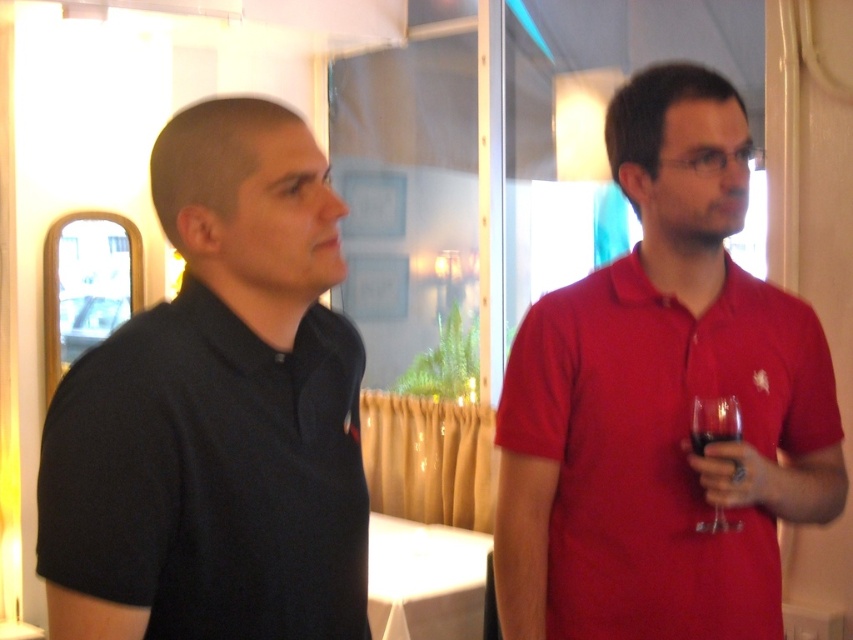
You are a photographer setting up for a group photo. You need to position two people exactly 3 feet apart. Currently, the black matte shirt at left and the matte red polo shirt at right are positioned at their current spots. Can they stay in their current positions for the photo?

The distance between the black matte shirt at left and the matte red polo shirt at right is 24.59 inches, which is less than 3 feet. Therefore, they need to move further apart to meet the 36 inches requirement for the group photo.

You are at a social gathering and want to move from the person on the right to the person on the left. Based on the coordinates provided, will you pass through the area of point (x=624, y=552) first or point (x=695, y=412) first?

Since point (x=624, y=552) is behind point (x=695, y=412), you will pass through point (x=695, y=412) first before reaching point (x=624, y=552) when moving from the person on the right to the person on the left.

You are standing in the room and want to locate the matte red polo shirt at right. According to the coordinates provided, where would you find it?

The matte red polo shirt at right is located at the coordinates point [662,403].